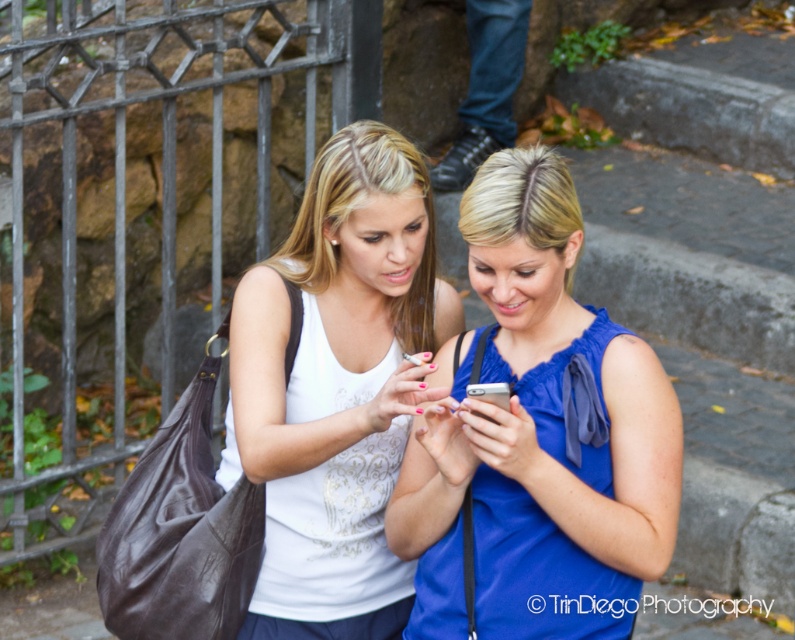
You are a photographer trying to capture a clear shot of both the blue satin blouse at center and the white satin tank top at center. Since you want both to be in focus, which one should you adjust your camera focus to prioritize first?

You should prioritize focusing on the blue satin blouse at center first because it is closer to the viewer than the white satin tank top at center, ensuring both will be in focus when using depth of field appropriately.

You are standing in front of the stone wall with the metal gate and want to place two markers at the specified points. Which of the two points, point (592,584) or point (353,618), is closer to you?

Point (592,584) is closer to the viewer than point (353,618).

You are a photographer trying to capture a photo of the blue satin blouse at center. The camera has a focal point at coordinates 0.5,0.5. Will the blouse be in focus if you use this focal point?

The blue satin blouse at center is located at coordinates (538, 436), which is slightly offset from the camera focal point at (397, 320). Therefore, the blouse may not be in perfect focus unless the camera adjusts its focus to the blouse.